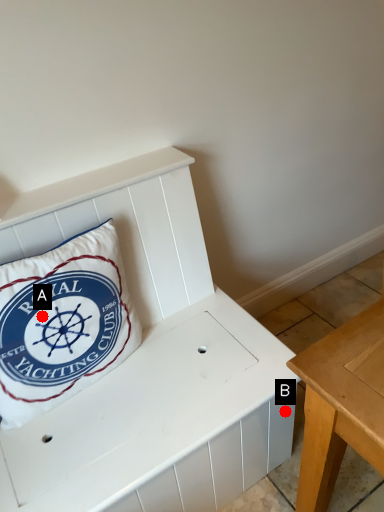
Question: Two points are circled on the image, labeled by A and B beside each circle. Which point is farther from the camera taking this photo?

Choices:
 (A) A is further
 (B) B is further

Answer: (B)